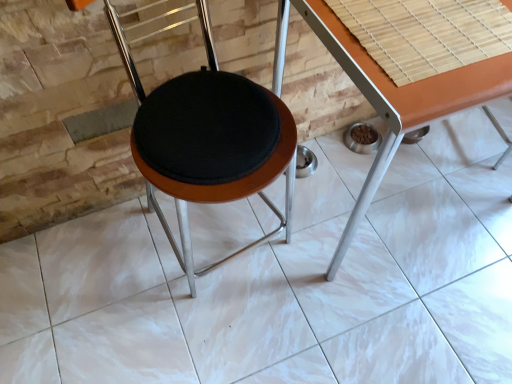
You are a GUI agent. You are given a task and a screenshot of the screen. Output one action in this format:
    pyautogui.click(x=<x>, y=<y>)
    Task: Click on the vacant space that is in between black fabric cushion at center and orange laminate table at center
    
    Given the screenshot: What is the action you would take?
    pyautogui.click(x=274, y=302)